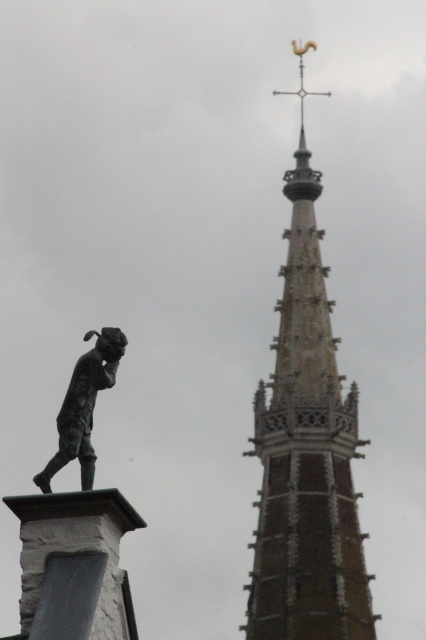
Question: Which point appears closest to the camera in this image?

Choices:
 (A) (52, 461)
 (B) (279, 467)

Answer: (A)

Question: Which of the following is the closest to the observer?

Choices:
 (A) bronze statue at left
 (B) brown stone spire at upper center

Answer: (A)

Question: Does brown stone spire at upper center have a larger size compared to bronze statue at left?

Choices:
 (A) no
 (B) yes

Answer: (B)

Question: Does brown stone spire at upper center have a greater width compared to bronze statue at left?

Choices:
 (A) no
 (B) yes

Answer: (B)

Question: Does brown stone spire at upper center have a larger size compared to bronze statue at left?

Choices:
 (A) no
 (B) yes

Answer: (B)